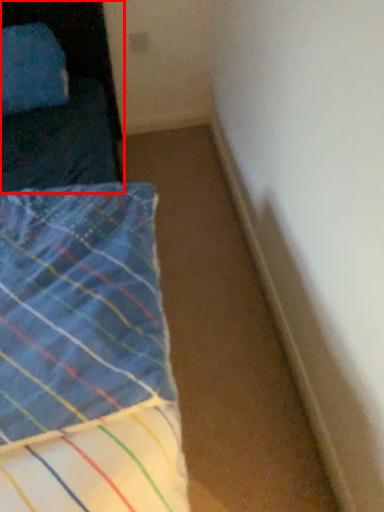
Question: Considering the relative positions of furniture (annotated by the red box) and bed in the image provided, where is furniture (annotated by the red box) located with respect to the staircase?

Choices:
 (A) right
 (B) left

Answer: (B)